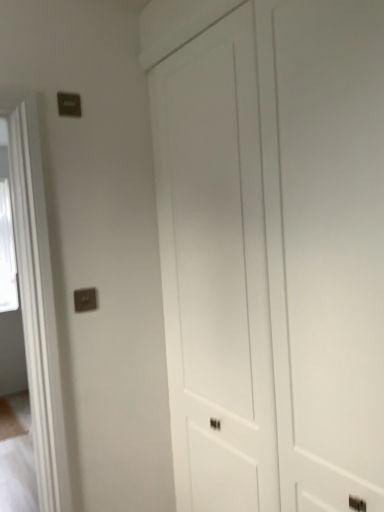
Describe the element at coordinates (275, 256) in the screenshot. I see `white matte door at center` at that location.

I want to click on white matte door at center, so click(x=275, y=256).

The width and height of the screenshot is (384, 512). What do you see at coordinates (85, 300) in the screenshot? I see `matte silver switch at upper left` at bounding box center [85, 300].

Locate an element on the screen. This screenshot has width=384, height=512. matte silver switch at upper left is located at coordinates (85, 300).

What is the approximate width of matte silver switch at upper left?

matte silver switch at upper left is 0.88 inches in width.

This screenshot has width=384, height=512. I want to click on white matte door at center, so click(x=275, y=256).

Between matte silver switch at upper left and white matte door at center, which one appears on the right side from the viewer's perspective?

From the viewer's perspective, white matte door at center appears more on the right side.

Which is behind, matte silver switch at upper left or white matte door at center?

matte silver switch at upper left is further from the camera.

Between point (81, 312) and point (244, 31), which one is positioned in front?

Positioned in front is point (244, 31).

From the image's perspective, is matte silver switch at upper left over white matte door at center?

Yes, from the image's perspective, matte silver switch at upper left is over white matte door at center.

From a real-world perspective, who is located lower, matte silver switch at upper left or white matte door at center?

From a 3D spatial view, white matte door at center is below.

Considering the sizes of matte silver switch at upper left and white matte door at center in the image, is matte silver switch at upper left wider or thinner than white matte door at center?

matte silver switch at upper left is thinner than white matte door at center.

Considering the sizes of objects matte silver switch at upper left and white matte door at center in the image provided, who is taller, matte silver switch at upper left or white matte door at center?

white matte door at center is taller.

Considering the sizes of matte silver switch at upper left and white matte door at center in the image, is matte silver switch at upper left bigger or smaller than white matte door at center?

In the image, matte silver switch at upper left appears to be smaller than white matte door at center.

Would you say matte silver switch at upper left is inside or outside white matte door at center?

matte silver switch at upper left is not inside white matte door at center, it's outside.

Is matte silver switch at upper left next to white matte door at center?

No, matte silver switch at upper left is not beside white matte door at center.

Is matte silver switch at upper left positioned with its back to white matte door at center?

matte silver switch at upper left is not turned away from white matte door at center.

How different are the orientations of matte silver switch at upper left and white matte door at center in degrees?

matte silver switch at upper left and white matte door at center are facing 88.1 degrees away from each other.

Identify the location of door that appears in front of the matte silver switch at upper left. This screenshot has width=384, height=512. (275, 256).

Visually, is white matte door at center positioned to the left or to the right of matte silver switch at upper left?

white matte door at center is to the right of matte silver switch at upper left.

Which object is further away from the camera, white matte door at center or matte silver switch at upper left?

matte silver switch at upper left is further away from the camera.

Which is closer to the camera, (300, 237) or (94, 308)?

Positioned in front is point (300, 237).

From the image's perspective, is white matte door at center below matte silver switch at upper left?

Indeed, from the image's perspective, white matte door at center is shown beneath matte silver switch at upper left.

From a real-world perspective, between white matte door at center and matte silver switch at upper left, who is vertically lower?

In real-world perspective, white matte door at center is lower.

Considering the sizes of objects white matte door at center and matte silver switch at upper left in the image provided, who is thinner, white matte door at center or matte silver switch at upper left?

matte silver switch at upper left.

Which of these two, white matte door at center or matte silver switch at upper left, stands shorter?

Standing shorter between the two is matte silver switch at upper left.

Who is bigger, white matte door at center or matte silver switch at upper left?

Bigger between the two is white matte door at center.

Is white matte door at center completely or partially outside of matte silver switch at upper left?

Yes, white matte door at center is outside of matte silver switch at upper left.

Are white matte door at center and matte silver switch at upper left located far from each other?

No.

Is white matte door at center facing towards matte silver switch at upper left?

Yes, white matte door at center is facing matte silver switch at upper left.

This screenshot has width=384, height=512. Identify the location of door below the matte silver switch at upper left (from a real-world perspective). (275, 256).

Where is `door that is below the matte silver switch at upper left (from the image's perspective)`? The width and height of the screenshot is (384, 512). door that is below the matte silver switch at upper left (from the image's perspective) is located at coordinates (275, 256).

Locate an element on the screen. The width and height of the screenshot is (384, 512). door that appears in front of the matte silver switch at upper left is located at coordinates (275, 256).